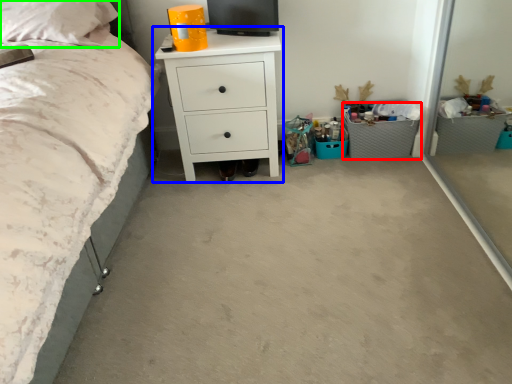
Question: Estimate the real-world distances between objects in this image. Which object is closer to crate (highlighted by a red box), chest of drawers (highlighted by a blue box) or pillow (highlighted by a green box)?

Choices:
 (A) chest of drawers
 (B) pillow

Answer: (A)